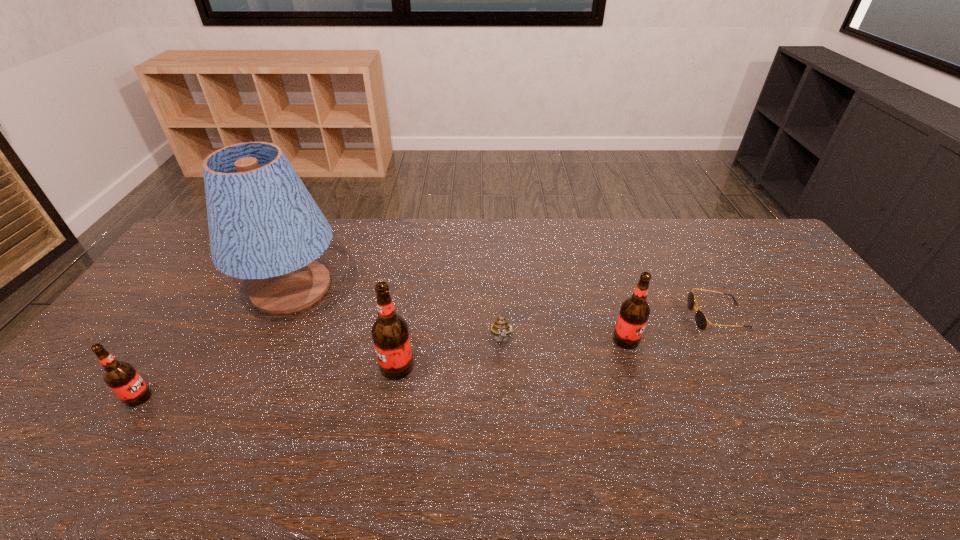
In the current image, all root beers are evenly spaced. To maintain this equal spacing, where should an additional root beer be placed on the right? Please point out a free spot. Please provide its 2D coordinates. Your answer should be formatted as a tuple, i.e. [(x, y)], where the tuple contains the x and y coordinates of a point satisfying the conditions above.

[(830, 316)]